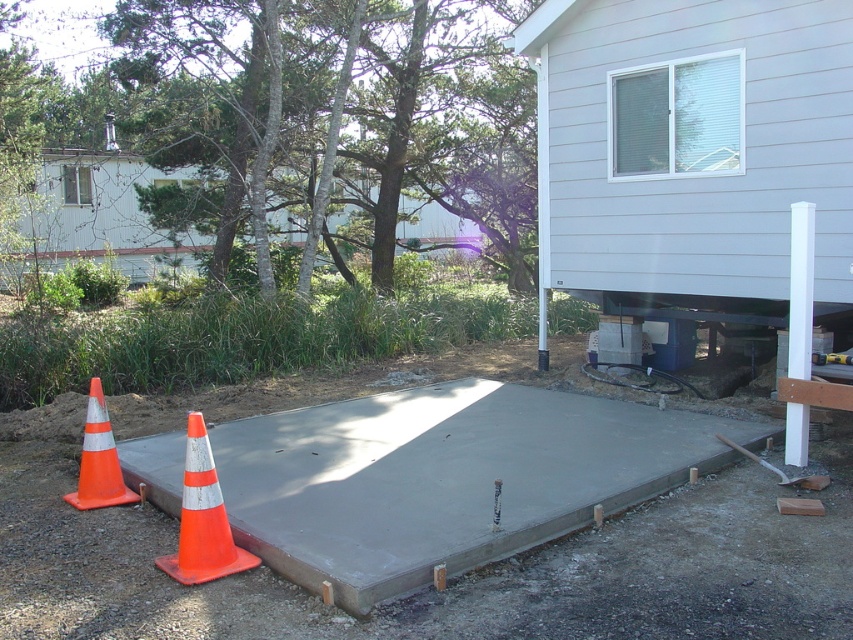
Question: Which object is positioned closest to the smooth concrete slab at center?

Choices:
 (A) orange/cone at left
 (B) orange/cone at lower left

Answer: (B)

Question: Does orange/cone at lower left have a greater width compared to orange/cone at left?

Choices:
 (A) yes
 (B) no

Answer: (A)

Question: Which point is farther to the camera?

Choices:
 (A) (190, 422)
 (B) (90, 474)

Answer: (B)

Question: Is smooth concrete slab at center to the right of orange/cone at lower left from the viewer's perspective?

Choices:
 (A) yes
 (B) no

Answer: (A)

Question: Is smooth concrete slab at center further to the viewer compared to orange/cone at left?

Choices:
 (A) yes
 (B) no

Answer: (B)

Question: Which object is farther from the camera taking this photo?

Choices:
 (A) smooth concrete slab at center
 (B) orange/cone at lower left
 (C) orange/cone at left

Answer: (C)